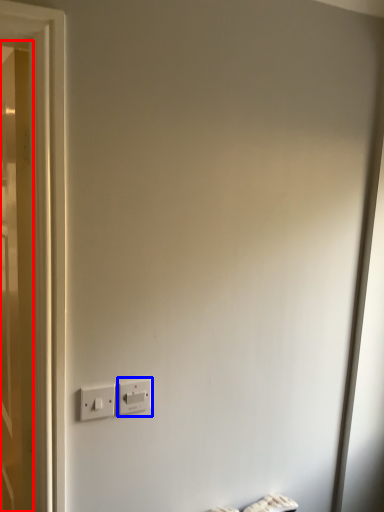
Question: Which object is closer to the camera taking this photo, door (highlighted by a red box) or power plugs and sockets (highlighted by a blue box)?

Choices:
 (A) door
 (B) power plugs and sockets

Answer: (A)